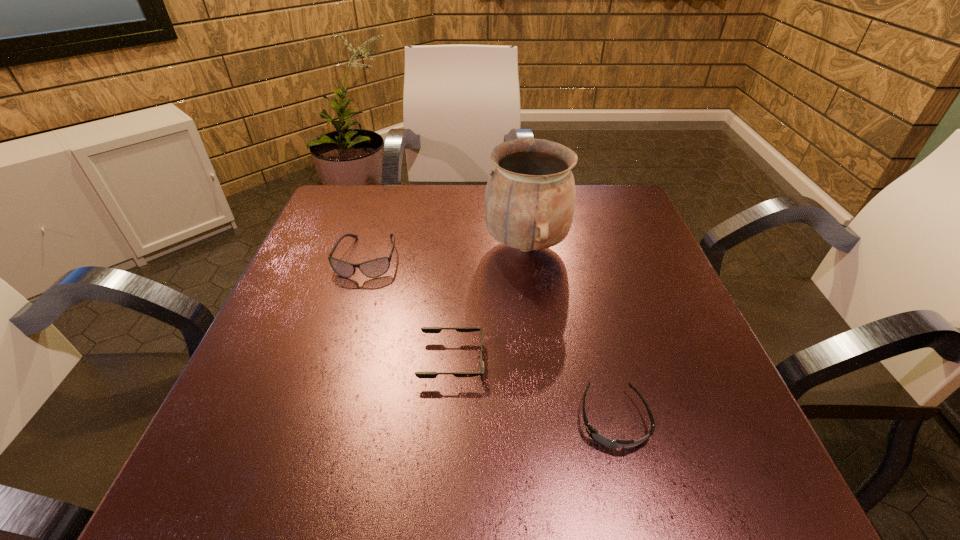
You are a GUI agent. You are given a task and a screenshot of the screen. Output one action in this format:
    pyautogui.click(x=<x>, y=<y>)
    Task: Click on the free spot located on the lenses of the nearest sunglasses
    Image resolution: width=960 pixels, height=540 pixels.
    Given the screenshot: What is the action you would take?
    pyautogui.click(x=633, y=496)

Find the location of a particular element. object located in the far edge section of the desktop is located at coordinates (529, 203).

You are a GUI agent. You are given a task and a screenshot of the screen. Output one action in this format:
    pyautogui.click(x=<x>, y=<y>)
    Task: Click on the object positioned at the near edge
    
    Given the screenshot: What is the action you would take?
    pyautogui.click(x=593, y=433)

You are a GUI agent. You are given a task and a screenshot of the screen. Output one action in this format:
    pyautogui.click(x=<x>, y=<y>)
    Task: Click on the object located at the left edge
    
    Given the screenshot: What is the action you would take?
    pyautogui.click(x=375, y=268)

Where is `object located at the right edge`? The image size is (960, 540). object located at the right edge is located at coordinates (593, 433).

Find the location of a particular element. object present at the near right corner is located at coordinates (593, 433).

Locate an element on the screen. vacant space at the far edge of the desktop is located at coordinates (420, 201).

Image resolution: width=960 pixels, height=540 pixels. In the image, there is a desktop. In order to click on free space at the near edge in this screenshot , I will do `click(449, 482)`.

You are a GUI agent. You are given a task and a screenshot of the screen. Output one action in this format:
    pyautogui.click(x=<x>, y=<y>)
    Task: Click on the free space at the left edge of the desktop
    
    Given the screenshot: What is the action you would take?
    pyautogui.click(x=291, y=305)

Where is `free region at the right edge`? The image size is (960, 540). free region at the right edge is located at coordinates (706, 352).